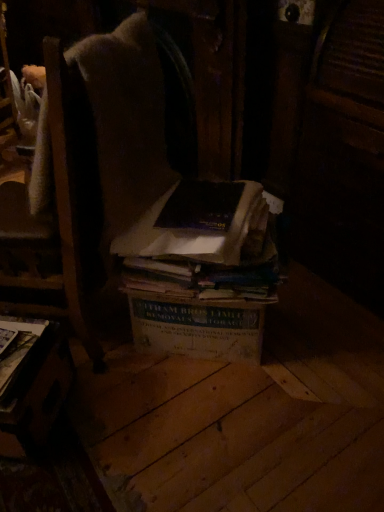
The height and width of the screenshot is (512, 384). What are the coordinates of `free spot in front of wooden table at lower left` in the screenshot? It's located at (49, 482).